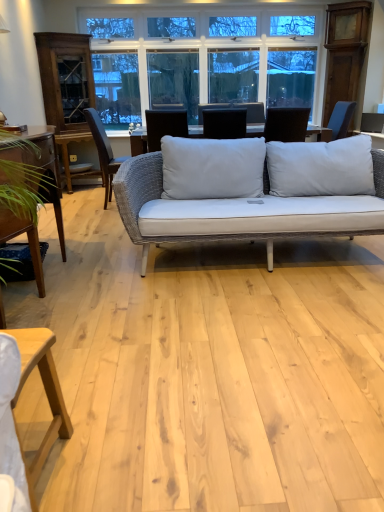
Question: Are wooden table at left, marked as the 2th table in a front-to-back arrangement, and dark brown wood chair at left, arranged as the first chair when viewed from the back, located far from each other?

Choices:
 (A) no
 (B) yes

Answer: (B)

Question: Can you confirm if wooden table at left, the first table from the top, is positioned to the right of dark brown wood chair at left, arranged as the first chair when viewed from the back?

Choices:
 (A) yes
 (B) no

Answer: (B)

Question: Is wooden table at left, marked as the 2th table in a front-to-back arrangement, wider than dark brown wood chair at left, the second chair from the front?

Choices:
 (A) yes
 (B) no

Answer: (A)

Question: Considering the relative sizes of wooden table at left, acting as the 2th table starting from the bottom, and dark brown wood chair at left, placed as the second chair when sorted from right to left, in the image provided, is wooden table at left, acting as the 2th table starting from the bottom, shorter than dark brown wood chair at left, placed as the second chair when sorted from right to left,?

Choices:
 (A) no
 (B) yes

Answer: (B)

Question: Is wooden table at left, acting as the 2th table starting from the bottom, bigger than dark brown wood chair at left, the second chair from the front?

Choices:
 (A) yes
 (B) no

Answer: (A)

Question: From the image's perspective, relative to white glass window at upper center, is wooden table at left, marked as the 2th table in a front-to-back arrangement, above or below?

Choices:
 (A) above
 (B) below

Answer: (B)

Question: Is wooden table at left, marked as the 2th table in a front-to-back arrangement, situated inside white glass window at upper center or outside?

Choices:
 (A) outside
 (B) inside

Answer: (A)

Question: Is point (21, 148) closer or farther from the camera than point (185, 94)?

Choices:
 (A) farther
 (B) closer

Answer: (B)

Question: Based on their positions, is wooden table at left, placed as the 2th table when sorted from right to left, located to the left or right of white glass window at upper center?

Choices:
 (A) right
 (B) left

Answer: (B)

Question: From a real-world perspective, is white glass window at upper center physically located above or below wooden table at left, which is the 1th table in left-to-right order?

Choices:
 (A) below
 (B) above

Answer: (B)

Question: Considering the positions of white glass window at upper center and wooden table at left, acting as the 1th table starting from the back, in the image, is white glass window at upper center bigger or smaller than wooden table at left, acting as the 1th table starting from the back,?

Choices:
 (A) small
 (B) big

Answer: (A)

Question: From the image's perspective, is white glass window at upper center located above or below wooden table at left, acting as the 2th table starting from the bottom?

Choices:
 (A) above
 (B) below

Answer: (A)

Question: In terms of width, does white glass window at upper center look wider or thinner when compared to wooden table at left, placed as the 2th table when sorted from right to left?

Choices:
 (A) thin
 (B) wide

Answer: (A)

Question: From their relative heights in the image, would you say matte black laptop at center, which is counted as the first chair, starting from the right, is taller or shorter than white glass window at upper center?

Choices:
 (A) short
 (B) tall

Answer: (A)

Question: Is matte black laptop at center, the 2th chair positioned from the left, inside or outside of white glass window at upper center?

Choices:
 (A) outside
 (B) inside

Answer: (A)